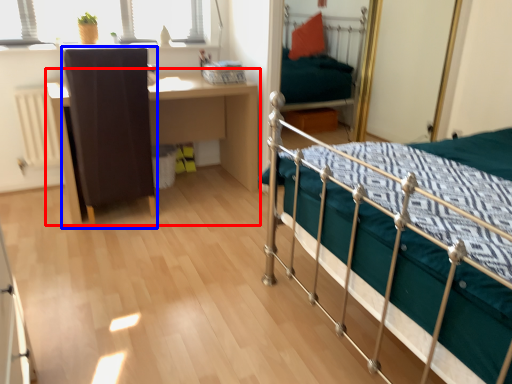
Question: Among these objects, which one is farthest to the camera, desk (highlighted by a red box) or chair (highlighted by a blue box)?

Choices:
 (A) desk
 (B) chair

Answer: (A)